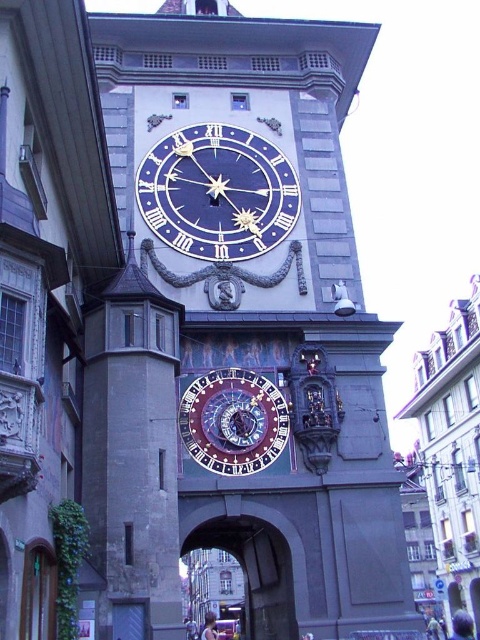
Question: Which point is farther to the camera?

Choices:
 (A) (217, 416)
 (B) (243, 195)

Answer: (B)

Question: Considering the real-world distances, which object is farthest from the stone archway at center?

Choices:
 (A) blue painted metal clock at center
 (B) polished brass clock at center
 (C) stone clock tower at center

Answer: (A)

Question: Which point is farther from the camera taking this photo?

Choices:
 (A) (252, 632)
 (B) (211, 132)

Answer: (A)

Question: Is polished brass clock at center to the left of stone archway at center from the viewer's perspective?

Choices:
 (A) no
 (B) yes

Answer: (B)

Question: Does blue painted metal clock at center appear over polished brass clock at center?

Choices:
 (A) no
 (B) yes

Answer: (B)

Question: Is blue painted metal clock at center wider than polished brass clock at center?

Choices:
 (A) no
 (B) yes

Answer: (B)